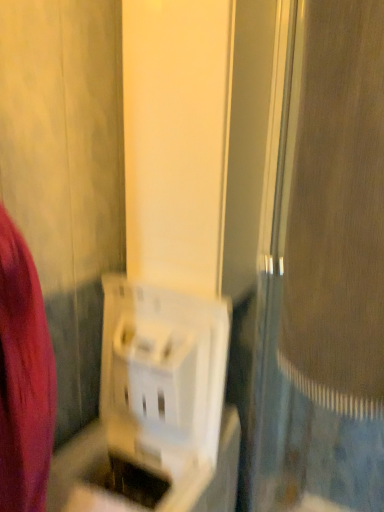
Question: From the image's perspective, is white plastic basket at center positioned above or below white plastic screen door at center?

Choices:
 (A) below
 (B) above

Answer: (A)

Question: Would you say white plastic basket at center is to the left or to the right of white plastic screen door at center in the picture?

Choices:
 (A) right
 (B) left

Answer: (B)

Question: Is white plastic basket at center spatially inside white plastic screen door at center, or outside of it?

Choices:
 (A) outside
 (B) inside

Answer: (A)

Question: Considering the positions of white plastic screen door at center and white plastic basket at center in the image, is white plastic screen door at center taller or shorter than white plastic basket at center?

Choices:
 (A) short
 (B) tall

Answer: (B)

Question: Considering their positions, is white plastic screen door at center located in front of or behind white plastic basket at center?

Choices:
 (A) behind
 (B) front

Answer: (B)

Question: From the image's perspective, is white plastic screen door at center located above or below white plastic basket at center?

Choices:
 (A) below
 (B) above

Answer: (B)

Question: Is white plastic screen door at center bigger or smaller than white plastic basket at center?

Choices:
 (A) big
 (B) small

Answer: (A)